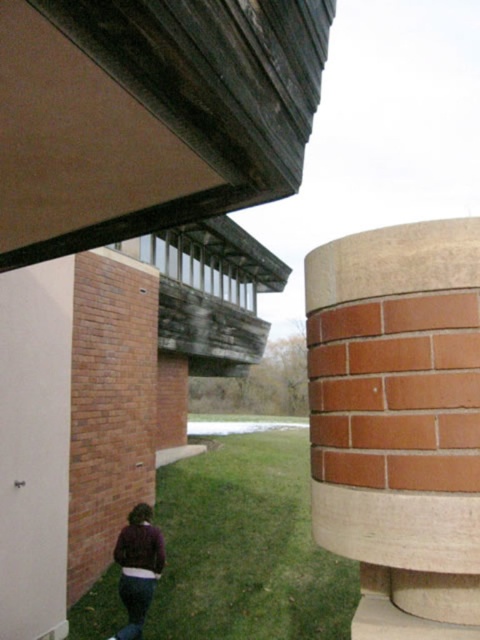
Can you confirm if purple sweater at lower left is thinner than purple fleece sweatshirt at lower center?

Yes.

Is purple sweater at lower left to the left of purple fleece sweatshirt at lower center from the viewer's perspective?

No, purple sweater at lower left is not to the left of purple fleece sweatshirt at lower center.

Is point (133, 582) positioned before point (134, 572)?

Yes, it is.

Where is `purple sweater at lower left`? This screenshot has height=640, width=480. purple sweater at lower left is located at coordinates (137, 566).

Where is `green grass at lower center`? This screenshot has width=480, height=640. green grass at lower center is located at coordinates (247, 545).

Is green grass at lower center in front of purple sweater at lower left?

No.

Who is more forward, (330, 564) or (157, 541)?

Point (157, 541) is in front.

At what (x,y) coordinates should I click in order to perform the action: click on green grass at lower center. Please return your answer as a coordinate pair (x, y). The width and height of the screenshot is (480, 640). Looking at the image, I should click on (247, 545).

Can you confirm if red brick column at center right is positioned above purple sweater at lower left?

Indeed, red brick column at center right is positioned over purple sweater at lower left.

Where is `red brick column at center right`? The width and height of the screenshot is (480, 640). red brick column at center right is located at coordinates (398, 422).